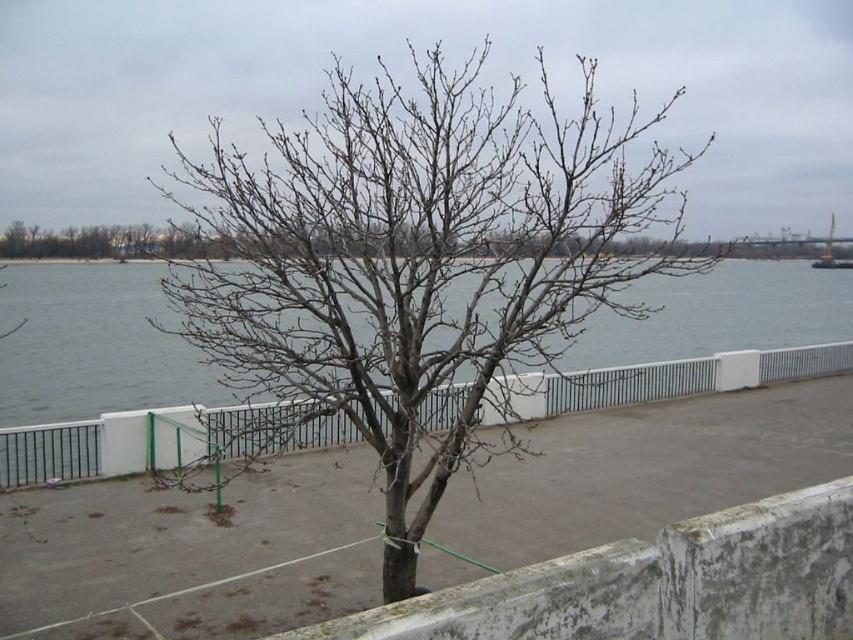
Question: Is white concrete fence at center smaller than metallic yellow crane at upper right?

Choices:
 (A) yes
 (B) no

Answer: (B)

Question: From the image, what is the correct spatial relationship of white concrete fence at center in relation to metallic yellow crane at upper right?

Choices:
 (A) left
 (B) right

Answer: (A)

Question: Which object is positioned closest to the bare branches at center?

Choices:
 (A) white concrete fence at center
 (B) metallic yellow crane at upper right

Answer: (A)

Question: Which object appears farthest from the camera in this image?

Choices:
 (A) white concrete fence at center
 (B) metallic yellow crane at upper right

Answer: (B)

Question: From the image, what is the correct spatial relationship of white concrete fence at center in relation to metallic yellow crane at upper right?

Choices:
 (A) below
 (B) above

Answer: (A)

Question: Based on their relative distances, which object is farther from the white concrete fence at center?

Choices:
 (A) metallic yellow crane at upper right
 (B) bare branches at center

Answer: (A)